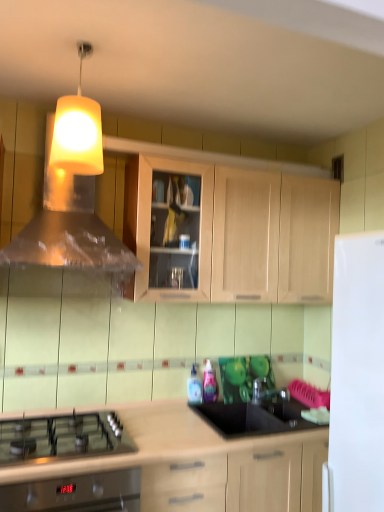
The width and height of the screenshot is (384, 512). In order to click on free spot in front of translucent plastic bottle at center, placed as the 2th bottle when sorted from right to left in this screenshot , I will do `click(183, 411)`.